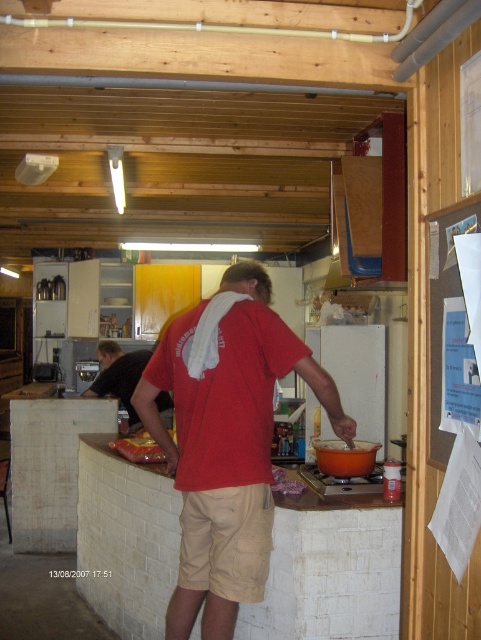
Which is behind, point (193, 483) or point (153, 456)?

The point (153, 456) is behind.

Does red matte shirt at center have a greater width compared to shiny plastic bag at counter left?

Correct, the width of red matte shirt at center exceeds that of shiny plastic bag at counter left.

Describe the element at coordinates (227, 436) in the screenshot. This screenshot has height=640, width=481. I see `red matte shirt at center` at that location.

This screenshot has width=481, height=640. I want to click on red matte shirt at center, so click(227, 436).

Is black cotton shirt at left wider than shiny plastic bag at counter left?

Yes.

Which of these two, black cotton shirt at left or shiny plastic bag at counter left, stands shorter?

Standing shorter between the two is shiny plastic bag at counter left.

Is point (121, 360) more distant than point (128, 440)?

Yes.

Find the location of a particular element. The width and height of the screenshot is (481, 640). black cotton shirt at left is located at coordinates (118, 376).

Who is lower down, white paperboard at right or shiny plastic bag at counter left?

shiny plastic bag at counter left is lower down.

Is white paperboard at right bigger than shiny plastic bag at counter left?

No, white paperboard at right is not bigger than shiny plastic bag at counter left.

Does point (446, 461) come farther from viewer compared to point (157, 458)?

No, (446, 461) is in front of (157, 458).

The image size is (481, 640). Identify the location of white paperboard at right. (443, 305).